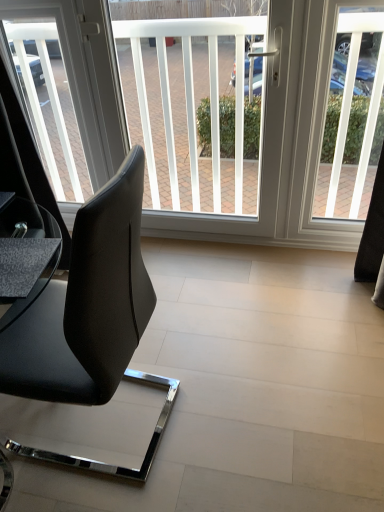
Question: Is white plastic window screen at upper right, the 3th window screen viewed from the left, further to the viewer compared to black leather chair at left?

Choices:
 (A) yes
 (B) no

Answer: (A)

Question: From the image's perspective, does white plastic window screen at upper right, which is the first window screen from right to left, appear lower than black leather chair at left?

Choices:
 (A) yes
 (B) no

Answer: (B)

Question: Is black leather chair at left at the back of white plastic window screen at upper right, the 3th window screen viewed from the left?

Choices:
 (A) yes
 (B) no

Answer: (B)

Question: Can you confirm if white plastic window screen at upper right, which is the first window screen from right to left, is smaller than black leather chair at left?

Choices:
 (A) yes
 (B) no

Answer: (A)

Question: Considering the relative sizes of white plastic window screen at upper right, which is the first window screen from right to left, and black leather chair at left in the image provided, is white plastic window screen at upper right, which is the first window screen from right to left, bigger than black leather chair at left?

Choices:
 (A) yes
 (B) no

Answer: (B)

Question: From a real-world perspective, is white plastic window screen at upper right, the 3th window screen viewed from the left, under black leather chair at left?

Choices:
 (A) yes
 (B) no

Answer: (B)

Question: Does white plastic window screen at center, the 2th window screen in the left-to-right sequence, have a greater height compared to matte black table at lower left?

Choices:
 (A) yes
 (B) no

Answer: (A)

Question: From a real-world perspective, is white plastic window screen at center, the 2th window screen in the left-to-right sequence, on matte black table at lower left?

Choices:
 (A) yes
 (B) no

Answer: (B)

Question: Can you confirm if white plastic window screen at center, which is counted as the 2th window screen, starting from the right, is shorter than matte black table at lower left?

Choices:
 (A) no
 (B) yes

Answer: (A)

Question: Is matte black table at lower left completely or partially inside white plastic window screen at center, which is counted as the 2th window screen, starting from the right?

Choices:
 (A) yes
 (B) no

Answer: (B)

Question: Is white plastic window screen at center, which is counted as the 2th window screen, starting from the right, not near matte black table at lower left?

Choices:
 (A) yes
 (B) no

Answer: (A)

Question: Is white plastic window screen at center, the 2th window screen in the left-to-right sequence, positioned before matte black table at lower left?

Choices:
 (A) no
 (B) yes

Answer: (A)

Question: Does transparent glass window screen at upper left, placed as the first window screen when sorted from left to right, have a greater height compared to matte black table at lower left?

Choices:
 (A) no
 (B) yes

Answer: (B)